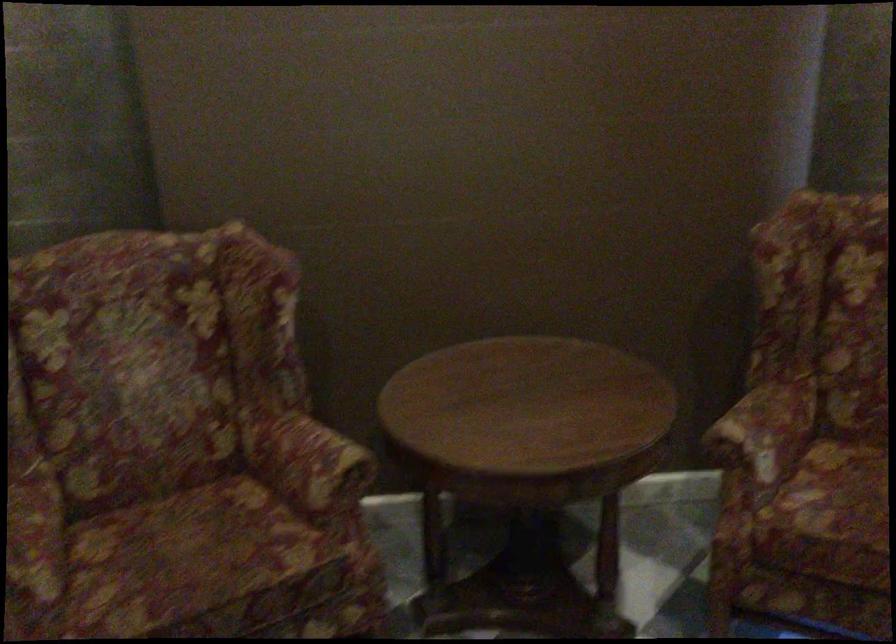
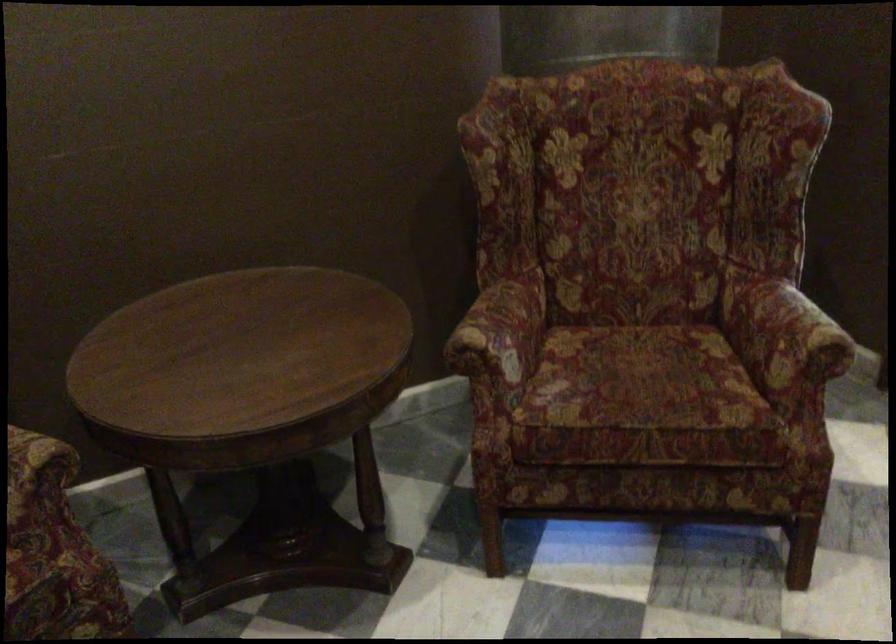
Question: The images are taken continuously from a first-person perspective. In which direction are you moving?

Choices:
 (A) Left
 (B) Right
 (C) Forward
 (D) Backward

Answer: (C)